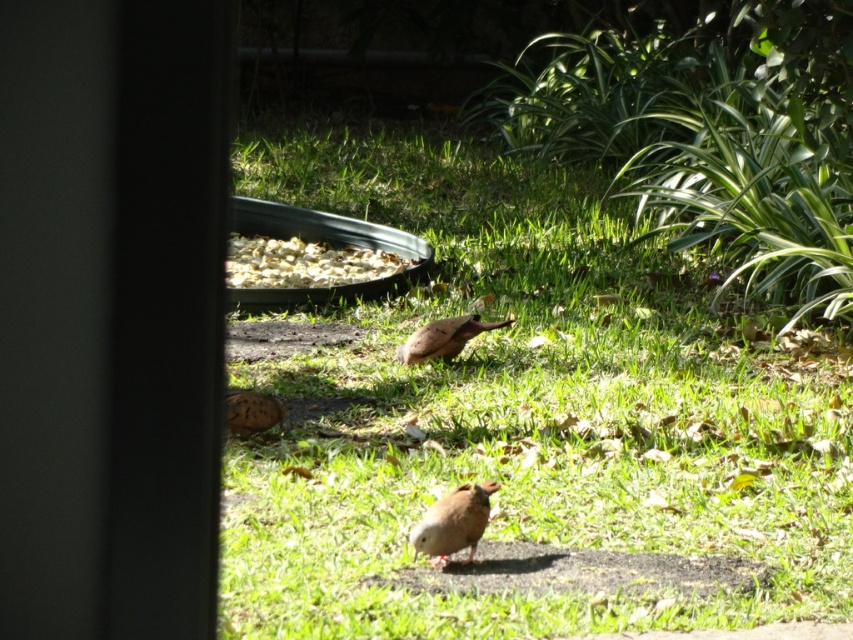
Consider the image. Is green grass at center behind white crumbly food at center?

No, green grass at center is in front of white crumbly food at center.

This screenshot has width=853, height=640. Describe the element at coordinates (525, 410) in the screenshot. I see `green grass at center` at that location.

The width and height of the screenshot is (853, 640). In order to click on green grass at center in this screenshot , I will do `click(525, 410)`.

Measure the distance between point (436, 506) and camera.

Point (436, 506) and camera are 4.00 meters apart.

Who is more distant from viewer, (x=462, y=541) or (x=445, y=337)?

The point (x=445, y=337) is more distant.

Who is more forward, (460, 516) or (408, 362)?

Point (460, 516) is more forward.

Image resolution: width=853 pixels, height=640 pixels. I want to click on brown speckled bird at center, so click(x=453, y=522).

Who is taller, green grass at center or brown speckled bird at center?

brown speckled bird at center

Can you confirm if green grass at center is shorter than brown speckled bird at center?

Correct, green grass at center is not as tall as brown speckled bird at center.

Where is `green grass at center`? green grass at center is located at coordinates (525, 410).